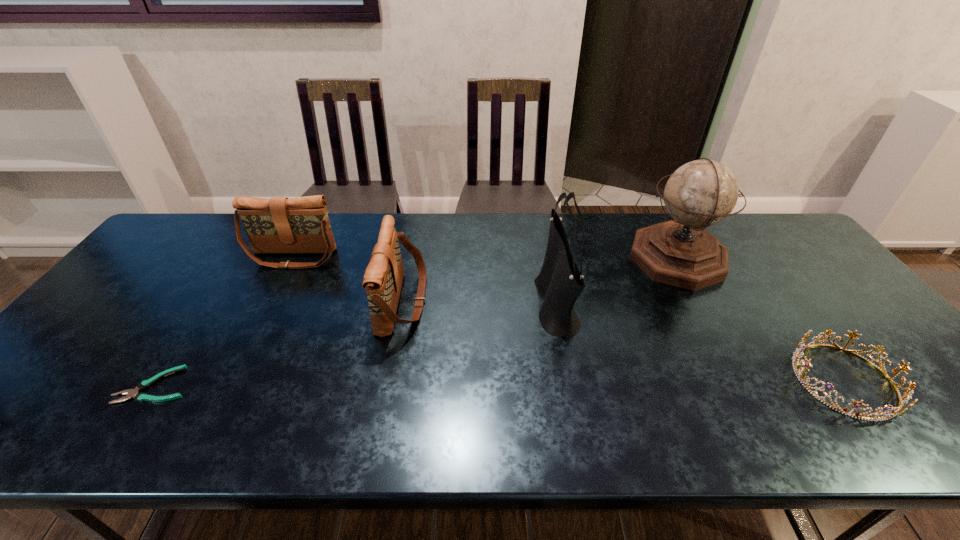
In order to click on free space that satisfies the following two spatial constraints: 1. on the front-facing side of the tallest shoulder bag; 2. on the right side of the leftmost shoulder bag in this screenshot , I will do `click(269, 306)`.

Identify the location of vacant region that satisfies the following two spatial constraints: 1. on the front-facing side of the second shoulder bag from right to left; 2. on the back side of the third object from right to left. (402, 306).

Locate an element on the screen. The width and height of the screenshot is (960, 540). vacant space that satisfies the following two spatial constraints: 1. on the front-facing side of the rightmost shoulder bag; 2. on the left side of the fourth object from right to left is located at coordinates (402, 306).

Identify the location of vacant area in the image that satisfies the following two spatial constraints: 1. on the front-facing side of the fourth object from right to left; 2. on the back side of the rightmost shoulder bag. This screenshot has height=540, width=960. (402, 306).

The image size is (960, 540). In order to click on vacant region that satisfies the following two spatial constraints: 1. on the front-facing side of the rightmost shoulder bag; 2. on the right side of the leftmost shoulder bag in this screenshot , I will do (269, 306).